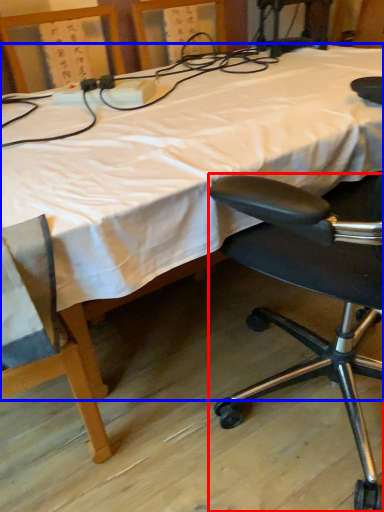
Question: Which point is further to the camera, chair (highlighted by a red box) or bed (highlighted by a blue box)?

Choices:
 (A) chair
 (B) bed

Answer: (B)